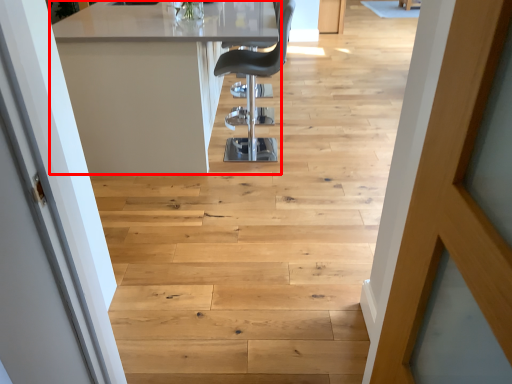
Question: Observing the image, what is the correct spatial positioning of table (annotated by the red box) in reference to chair?

Choices:
 (A) left
 (B) right

Answer: (A)